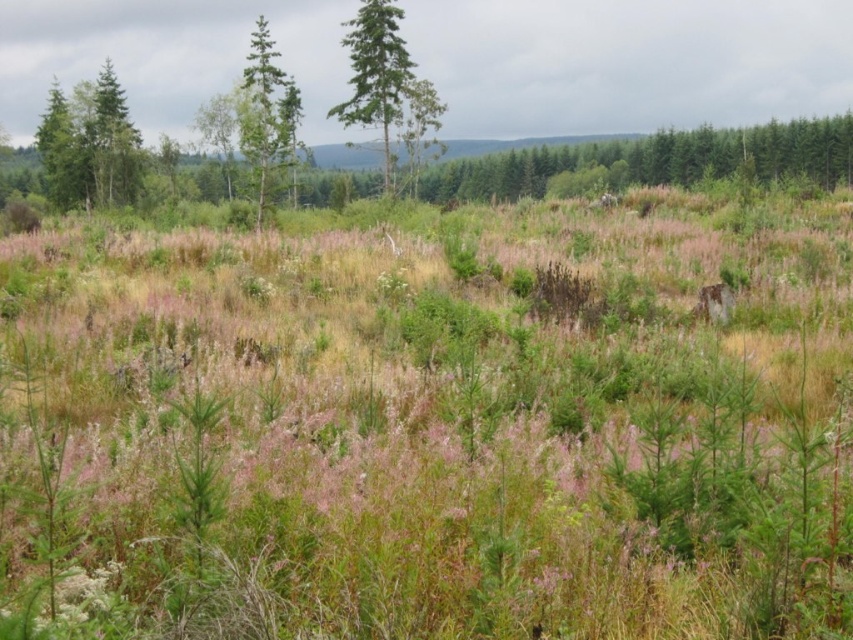
You are standing in the field and see the green grass at center and the green matte tree at left. Which object is closer to the ground?

The green grass at center is located below green matte tree at left, so it is closer to the ground.

You are a hiker who wants to walk from the green grass at center to the green matte tree at upper left. Given that your average walking pace is 3 feet per second, how many seconds will it take you to reach the tree?

The distance between the green grass at center and the green matte tree at upper left is 103.10 feet. At a pace of 3 feet per second, dividing the distance by the pace gives 103.10 divided by 3, which equals approximately 34.37 seconds. So, it will take roughly 34.4 seconds to reach the tree.

You are standing in the field of vegetation and want to walk towards the two points marked in the image. Which point, point (248, 99) or point (41, 132), is closer to you?

Point (248, 99) is closer to the viewer than point (41, 132), so you should head towards point (248, 99) first.